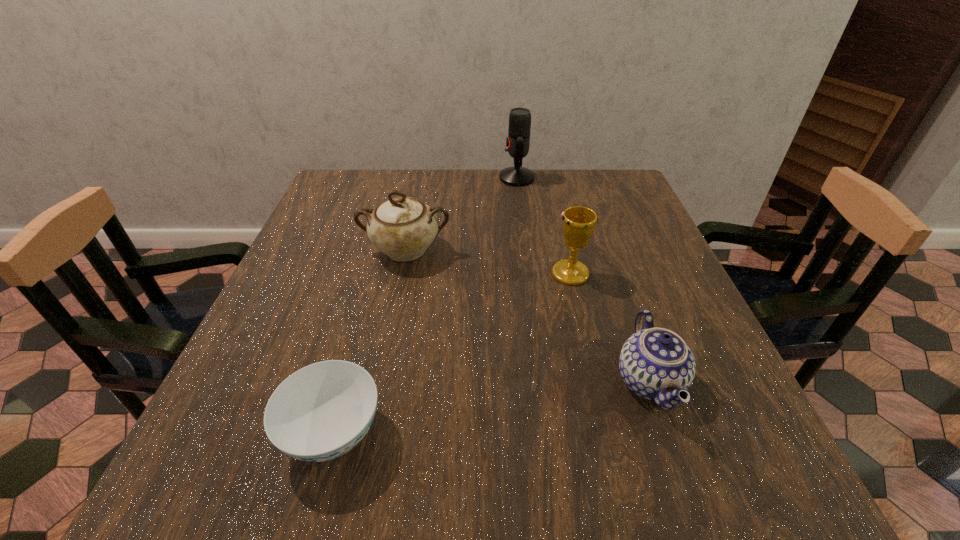
Where is `vacant space situated on the front of the farthest chinaware`? vacant space situated on the front of the farthest chinaware is located at coordinates (385, 348).

At what (x,y) coordinates should I click in order to perform the action: click on vacant space located 0.340m on the back of the chalice. Please return your answer as a coordinate pair (x, y). Image resolution: width=960 pixels, height=540 pixels. Looking at the image, I should click on (550, 188).

Where is `vacant space located at the spout of the second shortest object`? The height and width of the screenshot is (540, 960). vacant space located at the spout of the second shortest object is located at coordinates (524, 382).

At what (x,y) coordinates should I click in order to perform the action: click on vacant space located 0.330m at the spout of the second shortest object. Please return your answer as a coordinate pair (x, y). Looking at the image, I should click on (426, 382).

The image size is (960, 540). Identify the location of free spot located 0.200m at the spout of the second shortest object. pyautogui.click(x=501, y=382).

Locate an element on the screen. This screenshot has width=960, height=540. vacant region located on the back of the shortest object is located at coordinates (381, 257).

You are a GUI agent. You are given a task and a screenshot of the screen. Output one action in this format:
    pyautogui.click(x=<x>, y=<y>)
    Task: Click on the object that is at the far edge
    The width and height of the screenshot is (960, 540).
    Given the screenshot: What is the action you would take?
    pyautogui.click(x=518, y=140)

Image resolution: width=960 pixels, height=540 pixels. In order to click on object that is at the near edge in this screenshot , I will do click(x=322, y=411).

Identify the location of object that is at the right edge. The height and width of the screenshot is (540, 960). (655, 363).

At what (x,y) coordinates should I click in order to perform the action: click on object present at the near left corner. Please return your answer as a coordinate pair (x, y). Looking at the image, I should click on (322, 411).